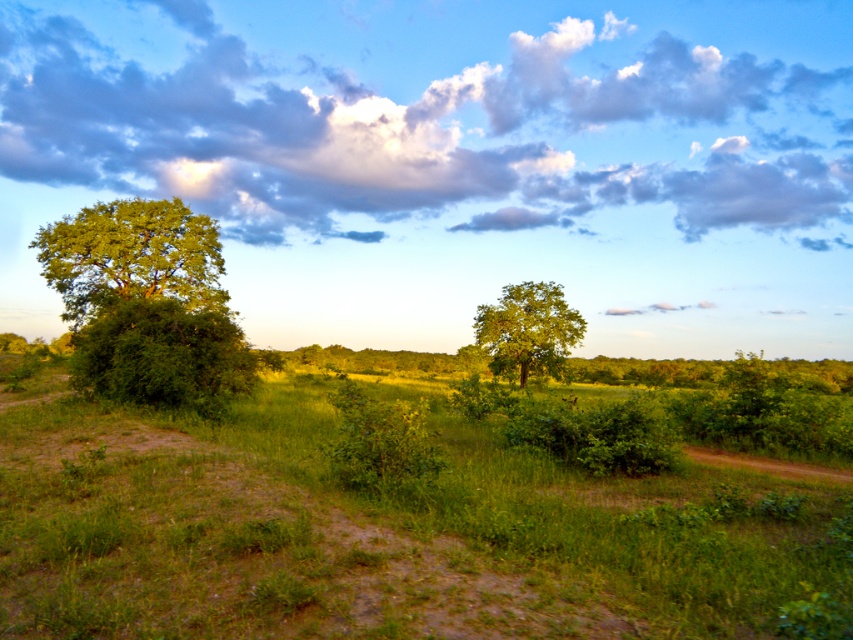
Can you confirm if green leafy tree at left is positioned to the right of green leafy tree at center?

In fact, green leafy tree at left is to the left of green leafy tree at center.

Consider the image. Between green leafy tree at left and green leafy tree at center, which one appears on the left side from the viewer's perspective?

green leafy tree at left

Between point (184, 221) and point (527, 291), which one is positioned behind?

Point (184, 221)

Locate an element on the screen. green leafy tree at left is located at coordinates (131, 257).

Can you confirm if green grass at center is shorter than green leafy tree at center?

Yes.

Which is below, green grass at center or green leafy tree at center?

green grass at center

At what (x,y) coordinates should I click in order to perform the action: click on green grass at center. Please return your answer as a coordinate pair (x, y). This screenshot has width=853, height=640. Looking at the image, I should click on (392, 531).

You are a GUI agent. You are given a task and a screenshot of the screen. Output one action in this format:
    pyautogui.click(x=<x>, y=<y>)
    Task: Click on the green grass at center
    The width and height of the screenshot is (853, 640).
    Given the screenshot: What is the action you would take?
    pyautogui.click(x=392, y=531)

Is green grass at center to the left of cloudy sky at upper center from the viewer's perspective?

Yes, green grass at center is to the left of cloudy sky at upper center.

Find the location of `green grass at center`. green grass at center is located at coordinates (392, 531).

You are a GUI agent. You are given a task and a screenshot of the screen. Output one action in this format:
    pyautogui.click(x=<x>, y=<y>)
    Task: Click on the green grass at center
    This screenshot has width=853, height=640.
    Given the screenshot: What is the action you would take?
    pyautogui.click(x=392, y=531)